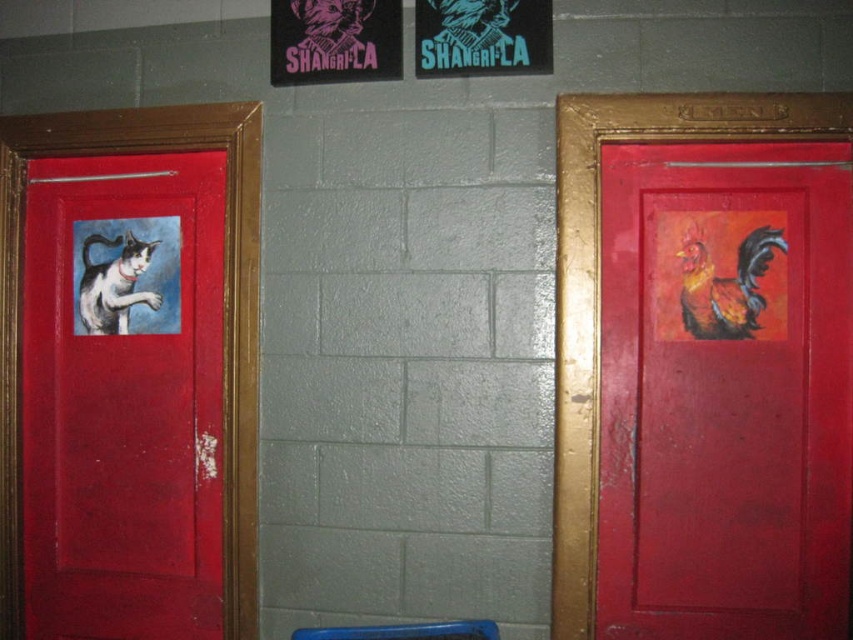
Question: From the image, what is the correct spatial relationship of matte red door at right in relation to matte pink poster at upper center?

Choices:
 (A) above
 (B) below

Answer: (B)

Question: Which point is closer to the camera?

Choices:
 (A) (732, 291)
 (B) (537, 54)
 (C) (596, 618)
 (D) (297, 13)

Answer: (C)

Question: Which of the following is the closest to the observer?

Choices:
 (A) (93, 289)
 (B) (344, 19)
 (C) (764, 227)
 (D) (352, 637)

Answer: (D)

Question: Which point is closer to the camera?

Choices:
 (A) (846, 490)
 (B) (496, 637)
 (C) (123, 236)
 (D) (276, 19)

Answer: (B)

Question: In this image, where is flaming orange rooster at right located relative to blue plastic stool at lower center?

Choices:
 (A) right
 (B) left

Answer: (A)

Question: Can you confirm if matte pink poster at upper center is positioned above flaming orange rooster at right?

Choices:
 (A) yes
 (B) no

Answer: (A)